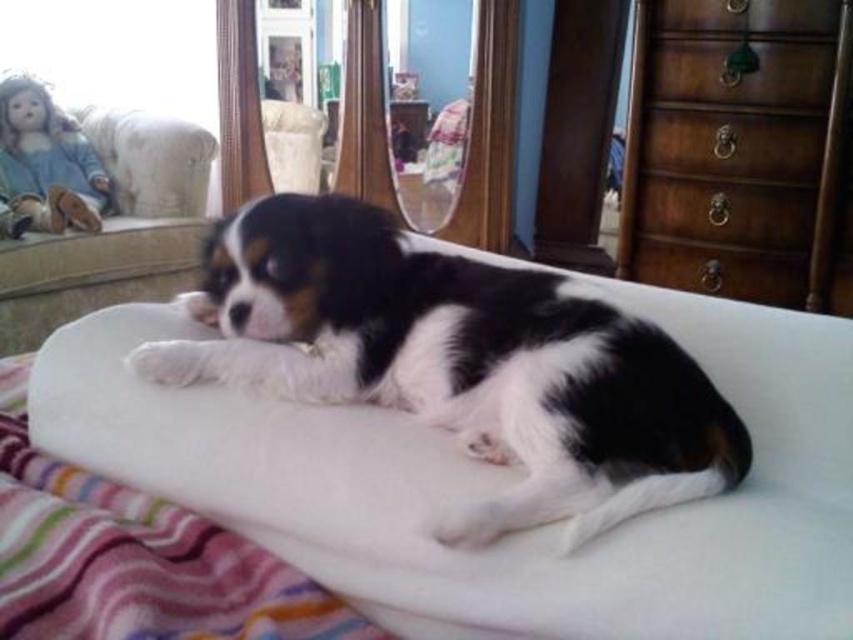
Based on the photo, can you confirm if white fluffy blanket at center is bigger than white fabric armchair at upper center?

Correct, white fluffy blanket at center is larger in size than white fabric armchair at upper center.

Does white fluffy blanket at center have a lesser height compared to white fabric armchair at upper center?

Indeed, white fluffy blanket at center has a lesser height compared to white fabric armchair at upper center.

Is point (90, 627) closer to viewer compared to point (317, 160)?

That is True.

Identify the location of white fluffy blanket at center. The height and width of the screenshot is (640, 853). (134, 557).

Is white fabric couch at upper center positioned behind white fabric armchair at upper center?

That is False.

Which of these two, white fabric couch at upper center or white fabric armchair at upper center, stands taller?

Standing taller between the two is white fabric couch at upper center.

Does point (120, 129) lie in front of point (308, 160)?

Yes, it is.

At what (x,y) coordinates should I click in order to perform the action: click on white fabric couch at upper center. Please return your answer as a coordinate pair (x, y). This screenshot has width=853, height=640. Looking at the image, I should click on (114, 236).

Which is more to the left, white fluffy blanket at center or white fabric couch at upper center?

white fabric couch at upper center

Does white fluffy blanket at center have a lesser height compared to white fabric couch at upper center?

Indeed, white fluffy blanket at center has a lesser height compared to white fabric couch at upper center.

Is point (265, 637) more distant than point (189, 204)?

No, it is not.

This screenshot has width=853, height=640. Identify the location of white fluffy blanket at center. (134, 557).